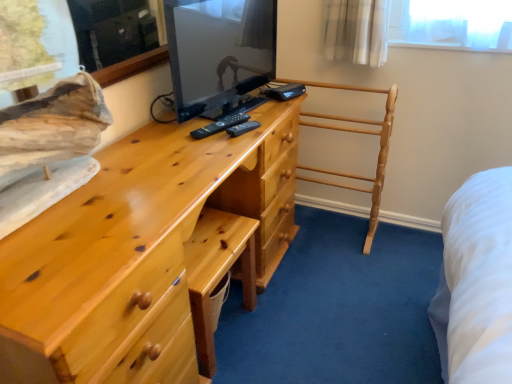
The height and width of the screenshot is (384, 512). I want to click on vacant region to the left of black plastic remote at center, so click(176, 125).